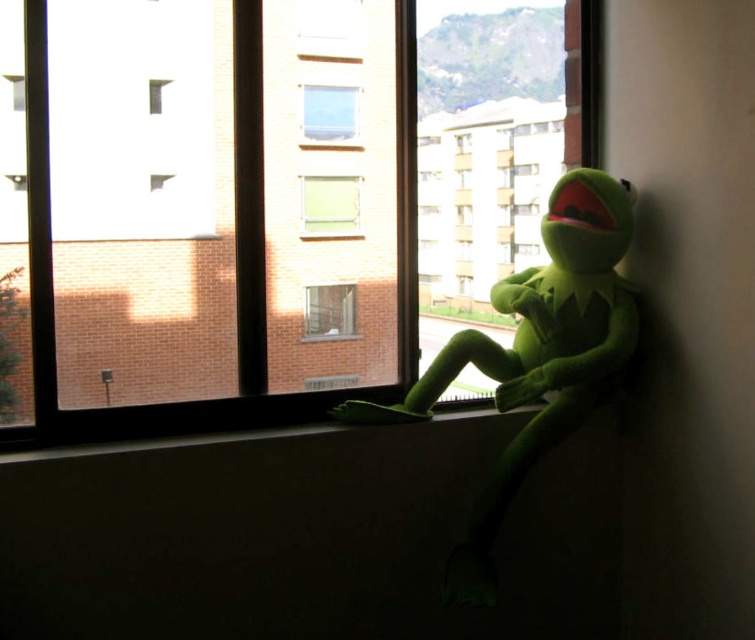
Question: Which object appears farthest from the camera in this image?

Choices:
 (A) green plush toy at window
 (B) clear glass window at center

Answer: (B)

Question: Is transparent glass window at upper center below green fabric curtain at center?

Choices:
 (A) yes
 (B) no

Answer: (A)

Question: Which of these objects is positioned closest to the green plush toy at window?

Choices:
 (A) clear glass window at center
 (B) green fabric curtain at center
 (C) transparent plastic window at upper center
 (D) transparent glass window at upper center

Answer: (D)

Question: Is green plush toy at window wider than transparent plastic window at upper center?

Choices:
 (A) yes
 (B) no

Answer: (A)

Question: Can you confirm if transparent glass window at upper center is positioned to the right of clear glass window at center?

Choices:
 (A) no
 (B) yes

Answer: (A)

Question: Which of the following is the farthest from the observer?

Choices:
 (A) (321, 220)
 (B) (461, 547)
 (C) (339, 296)
 (D) (399, 77)

Answer: (C)